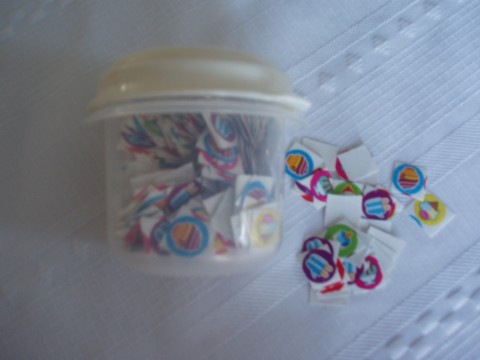
At what (x,y) coordinates should I click in order to perform the action: click on plastic cup. Please return your answer as a coordinate pair (x, y). Looking at the image, I should click on (117, 174).